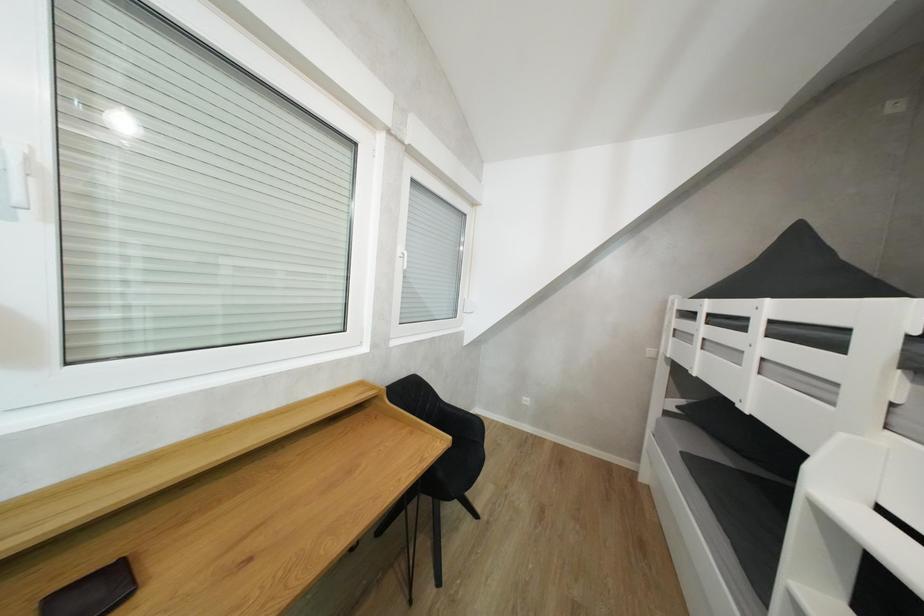
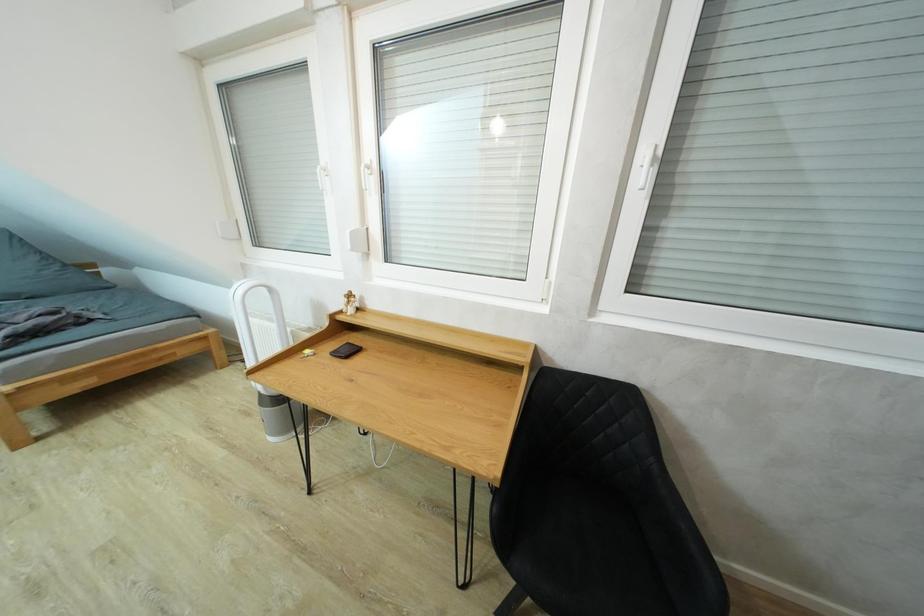
Question: The first image is from the beginning of the video and the second image is from the end. How did the camera likely rotate when shooting the video?

Choices:
 (A) Left
 (B) Right
 (C) Up
 (D) Down

Answer: (A)